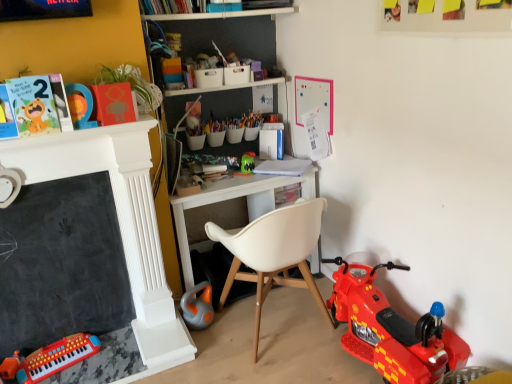
Where is `vacant space in front of green plastic toy at center, the fifth toy from the left`? The width and height of the screenshot is (512, 384). vacant space in front of green plastic toy at center, the fifth toy from the left is located at coordinates (250, 183).